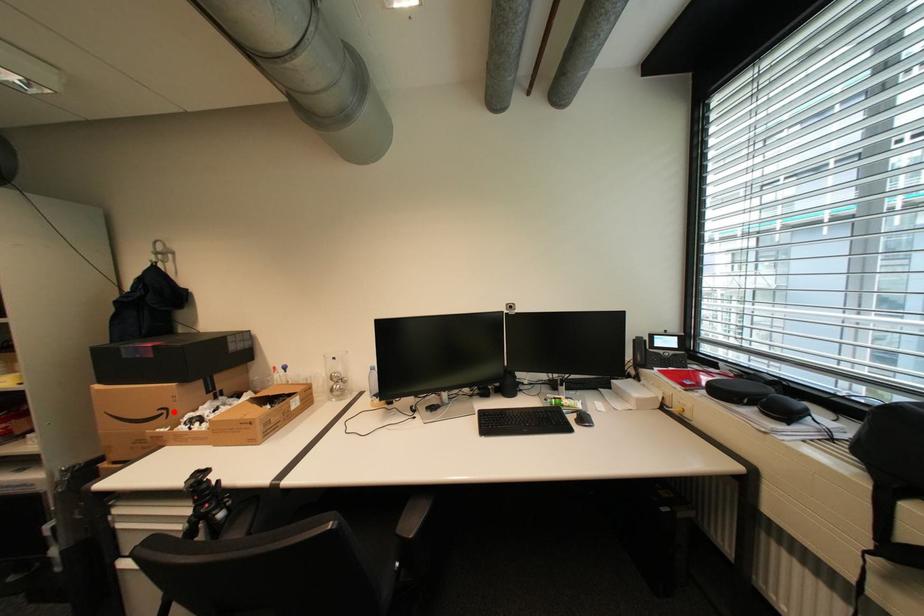
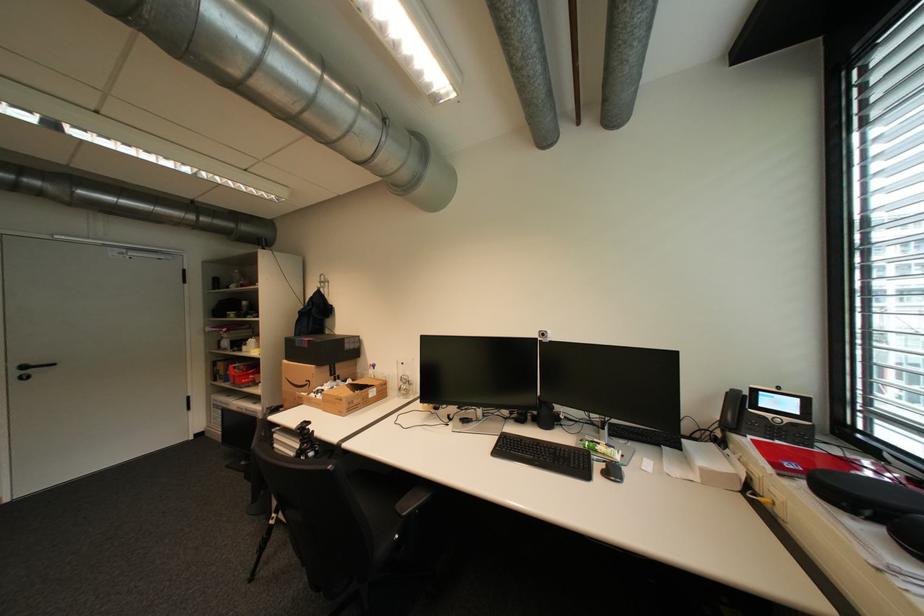
The point at the highlighted location is marked in the first image. Where is the corresponding point in the second image?

(317, 383)